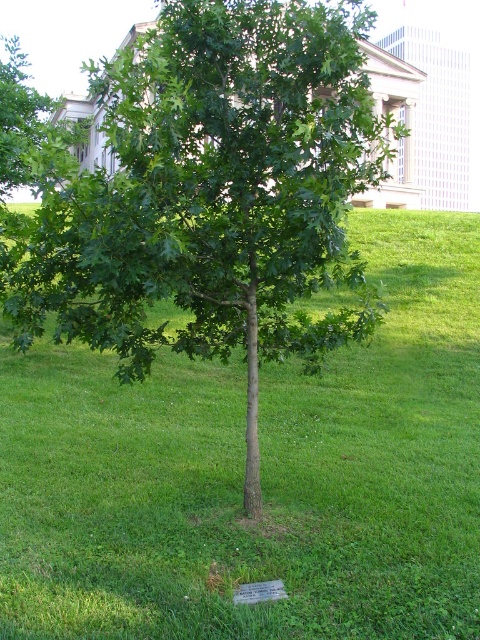
Question: Among these objects, which one is farthest from the camera?

Choices:
 (A) green grass at center
 (B) green leafy tree at center

Answer: (B)

Question: Considering the relative positions of green grass at center and green leafy tree at center in the image provided, where is green grass at center located with respect to green leafy tree at center?

Choices:
 (A) above
 (B) below

Answer: (A)

Question: Can you confirm if green grass at center is thinner than green leafy tree at center?

Choices:
 (A) no
 (B) yes

Answer: (A)

Question: Which point appears closest to the camera in this image?

Choices:
 (A) (136, 433)
 (B) (184, 275)

Answer: (B)

Question: Is green grass at center in front of green leafy tree at center?

Choices:
 (A) no
 (B) yes

Answer: (B)